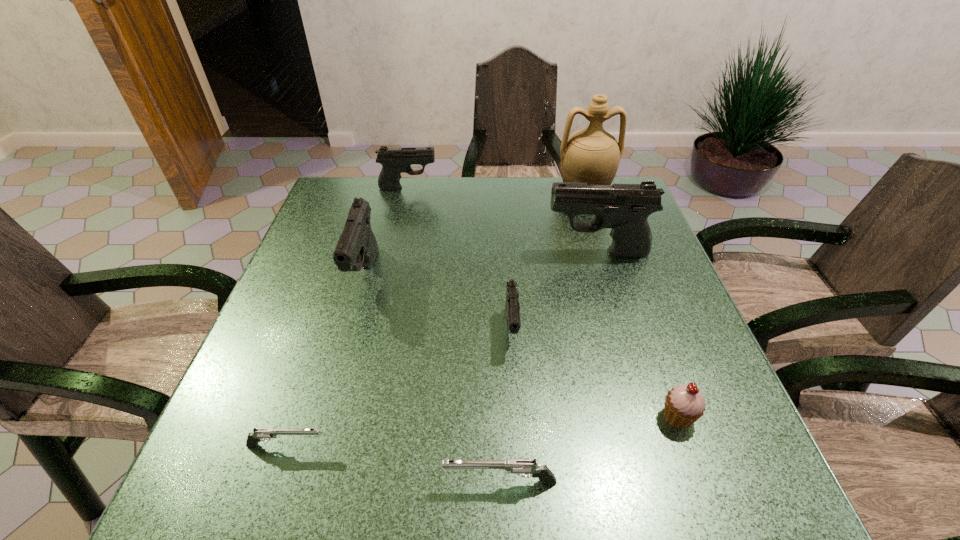
What are the coordinates of `pistol at the right edge` in the screenshot? It's located at (625, 208).

At what (x,y) coordinates should I click in order to perform the action: click on cupcake located in the right edge section of the desktop. Please return your answer as a coordinate pair (x, y). The image size is (960, 540). Looking at the image, I should click on (685, 404).

Where is `object at the far left corner`? object at the far left corner is located at coordinates (394, 161).

Locate an element on the screen. This screenshot has height=540, width=960. object that is at the far right corner is located at coordinates pos(592,155).

Identify the location of vacant space at the far edge of the desktop. (478, 191).

I want to click on free space at the near edge of the desktop, so click(600, 456).

Find the location of `vacant area at the left edge of the desktop`. vacant area at the left edge of the desktop is located at coordinates coord(300,331).

Locate an element on the screen. Image resolution: width=960 pixels, height=540 pixels. free region at the right edge is located at coordinates (660, 406).

Find the location of a particular element. This screenshot has height=540, width=960. empty location between the fifth shortest pistol and the cupcake is located at coordinates (521, 346).

This screenshot has height=540, width=960. In order to click on free area in between the fourth tallest object and the tallest pistol in this screenshot , I will do `click(503, 220)`.